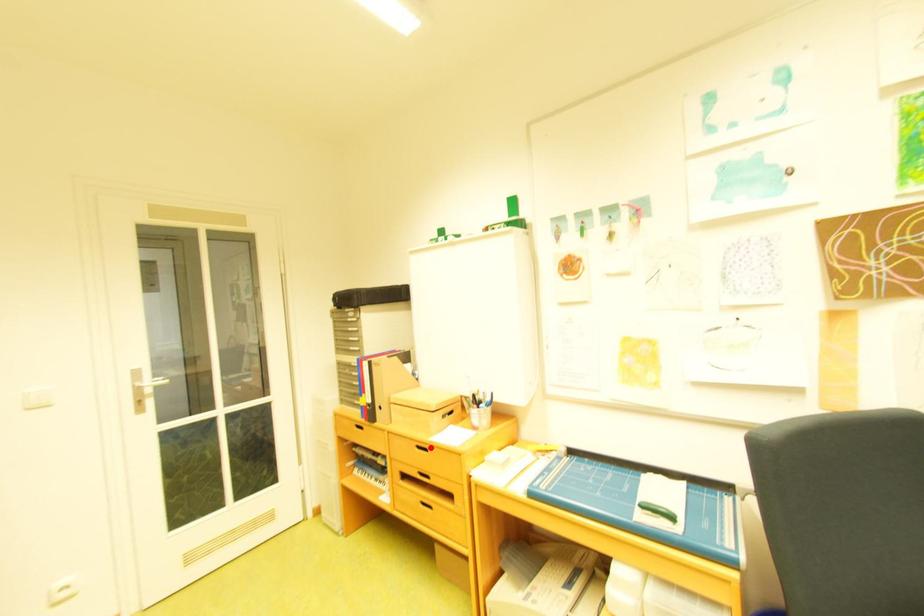
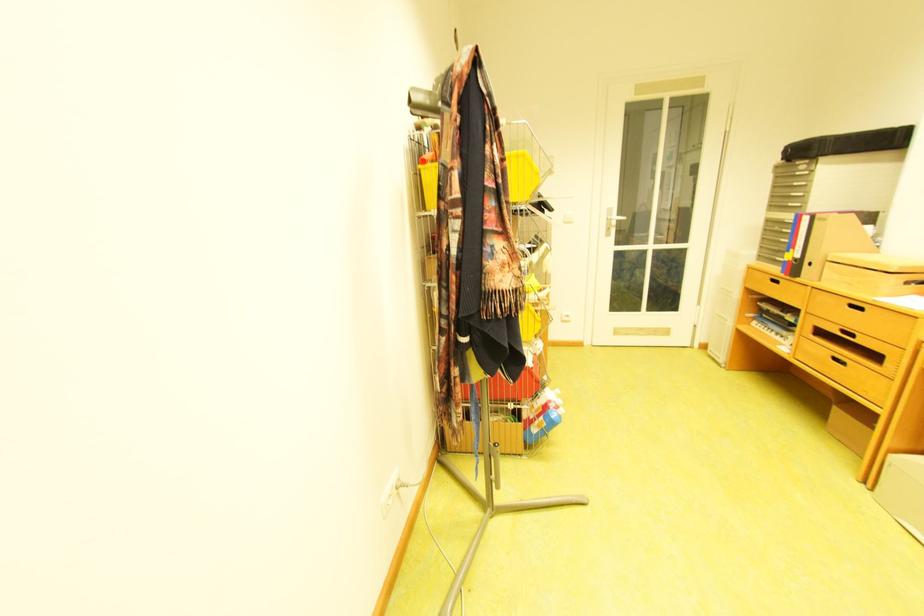
Question: I am providing you with two images of the same scene from different viewpoints. A red point is marked on the first image. Is the red point's position out of view in image 2?

Choices:
 (A) Yes
 (B) No

Answer: (B)